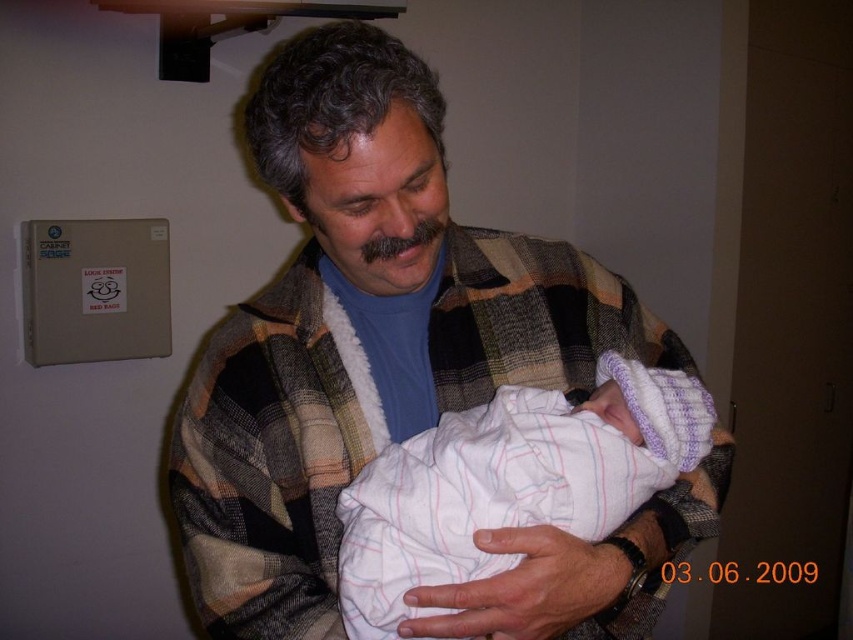
You are a nurse in a hospital room. You see two points marked on the cabinet labeled CABINET BAGS. Which point is closer to you, the point at coordinate (497, 301) or the point at (495, 477)?

Point (497, 301) is further to the viewer than point (495, 477), so the point at (495, 477) is closer to you.

You are a photographer positioned in front of the scene described. You want to capture a closeup shot of the plaid woolen shawl at center without any other objects in the frame. Based on the distance provided, what is the minimum distance you should maintain from the shawl to ensure it fills the frame while avoiding unwanted elements?

The plaid woolen shawl at center is 24.95 inches away from the camera. To ensure the shawl fills the frame without including other objects, the photographer should maintain a distance of at least 24.95 inches from the shawl.